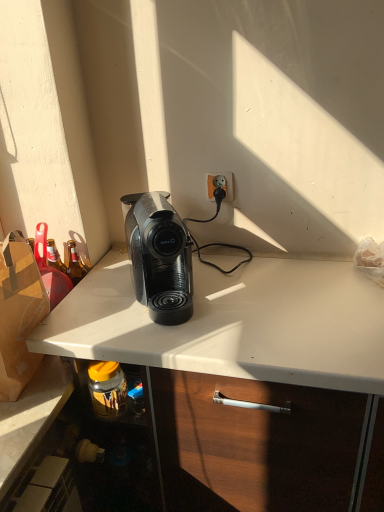
Question: Would you say orange matte power outlet at upper center is inside or outside black plastic coffee machine at center?

Choices:
 (A) outside
 (B) inside

Answer: (A)

Question: Considering the positions of orange matte power outlet at upper center and black plastic coffee machine at center in the image, is orange matte power outlet at upper center bigger or smaller than black plastic coffee machine at center?

Choices:
 (A) small
 (B) big

Answer: (A)

Question: From a real-world perspective, is orange matte power outlet at upper center physically located above or below black plastic coffee machine at center?

Choices:
 (A) above
 (B) below

Answer: (A)

Question: Considering the positions of point click(x=145, y=279) and point click(x=228, y=177), is point click(x=145, y=279) closer or farther from the camera than point click(x=228, y=177)?

Choices:
 (A) closer
 (B) farther

Answer: (A)

Question: From a real-world perspective, is black plastic coffee machine at center physically located above or below orange matte power outlet at upper center?

Choices:
 (A) below
 (B) above

Answer: (A)

Question: Looking at their shapes, would you say black plastic coffee machine at center is wider or thinner than orange matte power outlet at upper center?

Choices:
 (A) wide
 (B) thin

Answer: (A)

Question: Considering the positions of black plastic coffee machine at center and orange matte power outlet at upper center in the image, is black plastic coffee machine at center taller or shorter than orange matte power outlet at upper center?

Choices:
 (A) tall
 (B) short

Answer: (A)